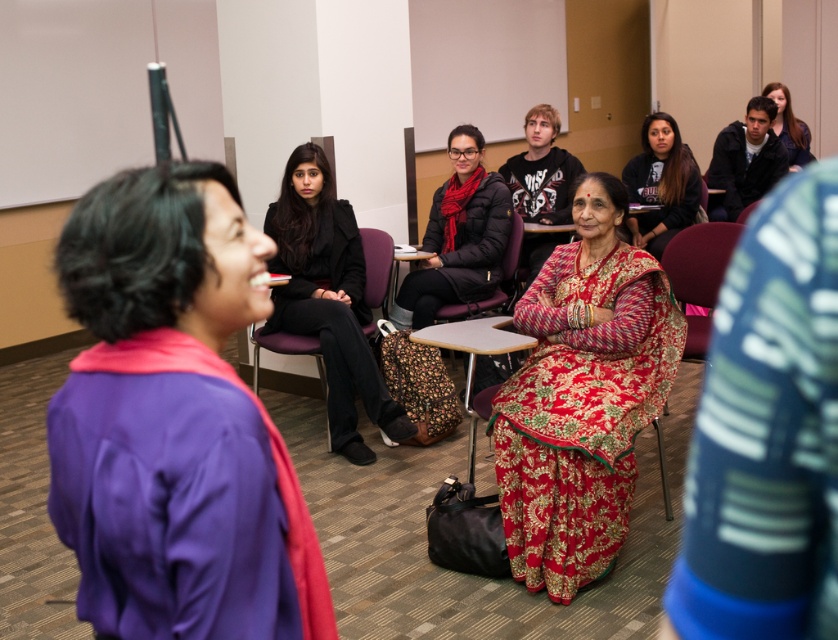
Can you confirm if red floral dress at center is taller than matte black jacket at upper right?

Indeed, red floral dress at center has a greater height compared to matte black jacket at upper right.

Identify the location of red floral dress at center. The image size is (838, 640). (661, 184).

Is red embroidered saree at center to the right of red floral dress at center from the viewer's perspective?

Incorrect, red embroidered saree at center is not on the right side of red floral dress at center.

Between red embroidered saree at center and red floral dress at center, which one has more height?

red embroidered saree at center is taller.

Does point (530, 497) lie in front of point (683, 182)?

Yes, point (530, 497) is in front of point (683, 182).

The width and height of the screenshot is (838, 640). What are the coordinates of `red embroidered saree at center` in the screenshot? It's located at (582, 396).

Does matte black jacket at center have a greater width compared to red floral dress at center?

No.

Between point (200, 230) and point (683, 216), which one is positioned behind?

Point (683, 216)

Find the location of a particular element. matte black jacket at center is located at coordinates (172, 428).